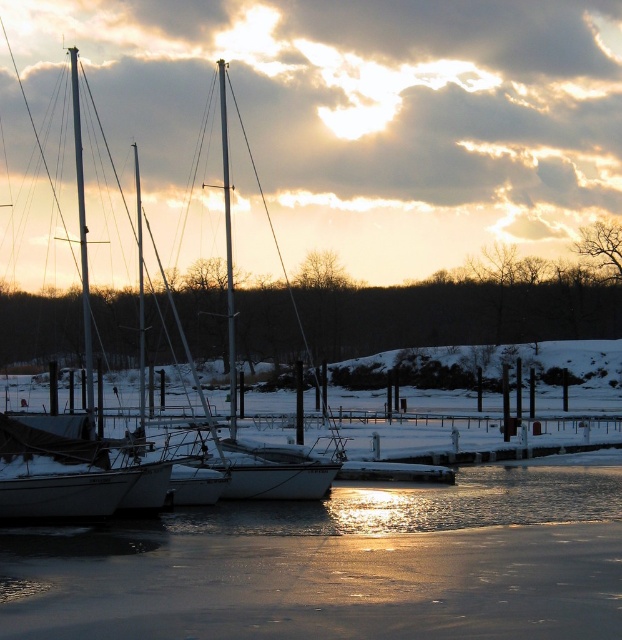
Question: Which point is farther to the camera?

Choices:
 (A) (230, 493)
 (B) (527, 474)

Answer: (B)

Question: Can you confirm if icy white water at center is positioned to the right of white matte sailboat at center?

Choices:
 (A) no
 (B) yes

Answer: (B)

Question: Is icy white water at center smaller than white matte sailboat at center?

Choices:
 (A) yes
 (B) no

Answer: (A)

Question: Among these objects, which one is farthest from the camera?

Choices:
 (A) icy white water at center
 (B) white matte sailboat at center

Answer: (B)

Question: Observing the image, what is the correct spatial positioning of icy white water at center in reference to white matte sailboat at center?

Choices:
 (A) above
 (B) below

Answer: (B)